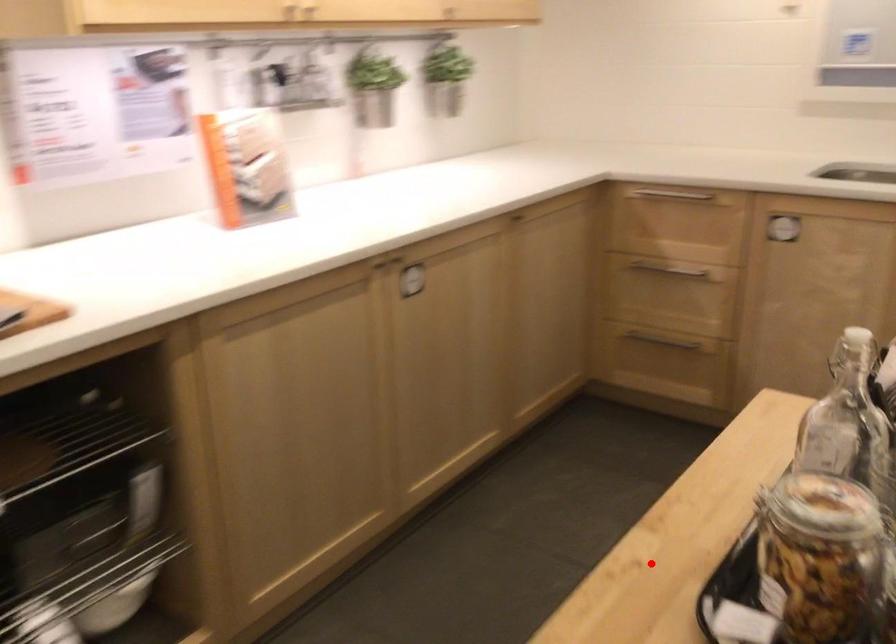
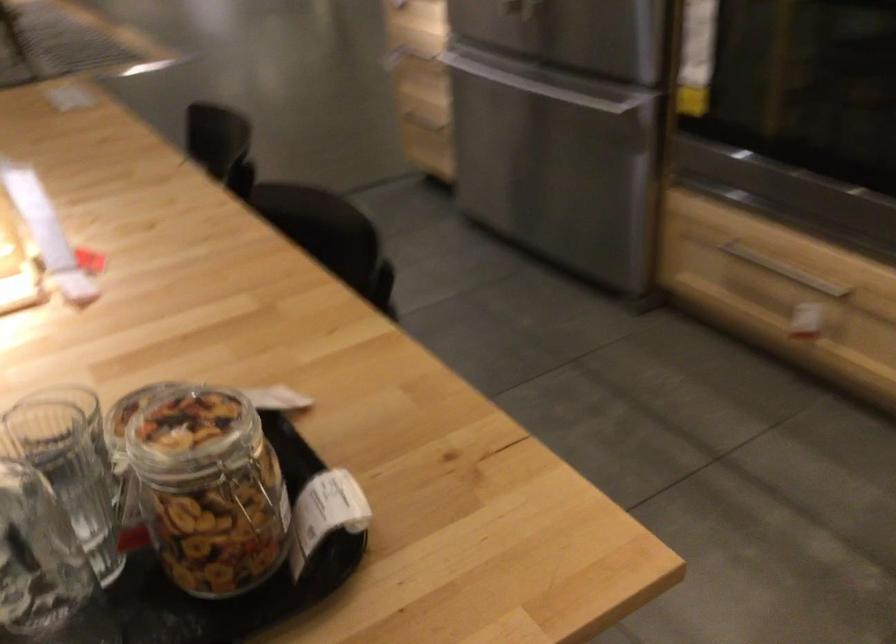
Question: I am providing you with two images of the same scene from different viewpoints. Given a red point in image1, look at the same physical point in image2. Is it:

Choices:
 (A) Closer to the viewpoint
 (B) Farther from the viewpoint

Answer: (A)